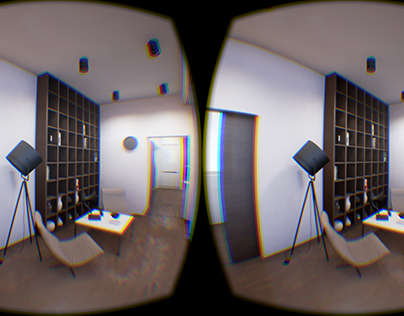
This screenshot has height=316, width=404. I want to click on tables, so click(385, 218), click(107, 220).